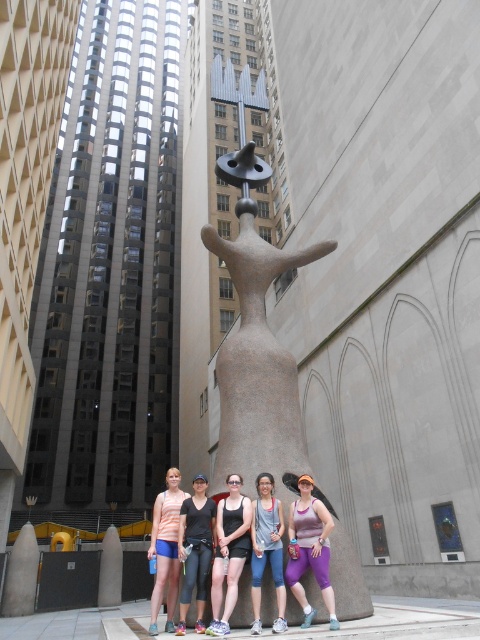
You are a photographer trying to capture a group photo. You notice two people wearing purple leggings at center and black leggings at center. Which pair of leggings is wider in the photo?

The purple leggings at center might be wider than black leggings at center.

You are a photographer trying to capture a group photo. You notice two people wearing purple leggings at center and black leggings at center. Which person should you ask to move closer to the front so that both can be clearly seen in the photo?

You should ask the person wearing purple leggings at center to move closer to the front because they occupy less space than the person in black leggings at center, allowing for better visibility in the photo.

You are a photographer trying to capture a closeup of the black leggings at center and the gray fabric tank top at center. Can you fit both into your camera frame if your camera has a minimum focus distance of 1 meter?

The black leggings at center and gray fabric tank top at center are 85.92 centimeters apart, which is less than 1 meter. Therefore, you can fit both into your camera frame since the distance between them is within the camera focus range.